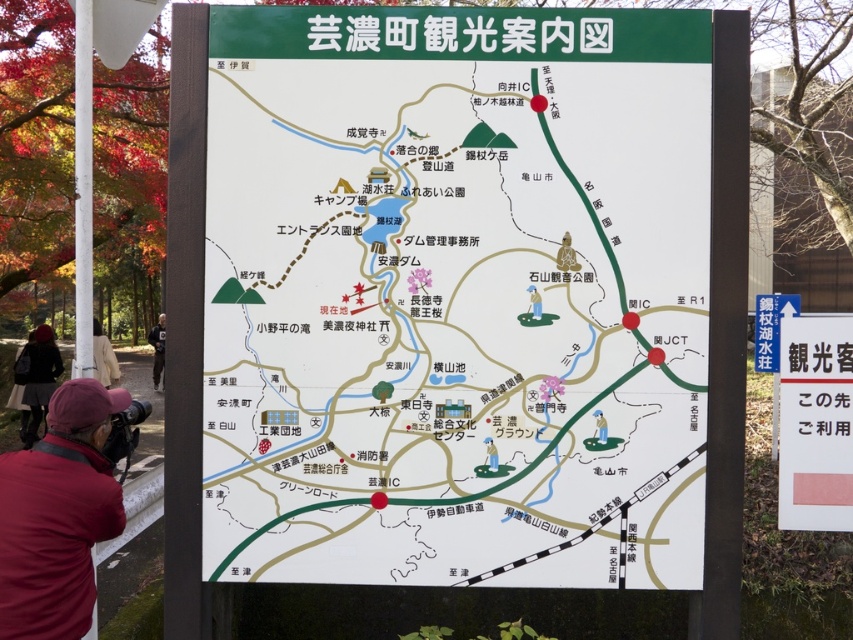
You are looking at the Yunokuchi Tourism Guide Map displayed on the signboard. You see a point labeled as point (157, 349). What does this point represent?

The point labeled as point (157, 349) represents the location of a dark gray jacket at left.

You are a tourist looking at the Yunokuchi Tourism Guide Map displayed on the signboard. You notice a white paper sign at upper right and a beige fabric jacket at left. Which object is taller?

The white paper sign at upper right is taller than the beige fabric jacket at left.